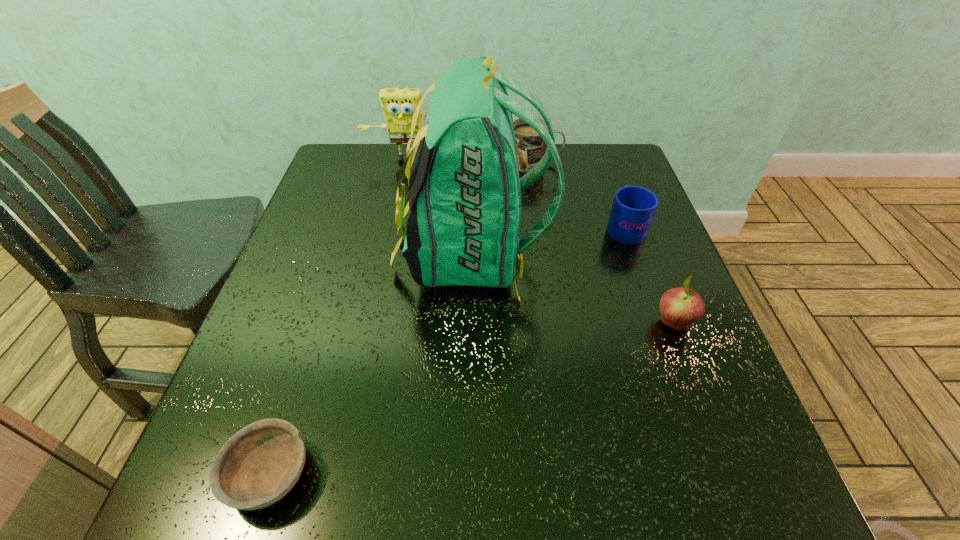
Find the location of `free space that satisfies the following two spatial constraints: 1. on the back of the apple; 2. on the left side of the tallest object`. free space that satisfies the following two spatial constraints: 1. on the back of the apple; 2. on the left side of the tallest object is located at coordinates (469, 323).

Where is `free space that satisfies the following two spatial constraints: 1. on the side with the handle of the nearer mug; 2. on the side of the farther mug with the handle`? free space that satisfies the following two spatial constraints: 1. on the side with the handle of the nearer mug; 2. on the side of the farther mug with the handle is located at coordinates (602, 164).

Where is `free space that satisfies the following two spatial constraints: 1. on the side of the left mug with the handle; 2. on the back side of the apple`? Image resolution: width=960 pixels, height=540 pixels. free space that satisfies the following two spatial constraints: 1. on the side of the left mug with the handle; 2. on the back side of the apple is located at coordinates (561, 323).

Locate an element on the screen. The height and width of the screenshot is (540, 960). vacant space that satisfies the following two spatial constraints: 1. on the back side of the apple; 2. on the side of the farther mug with the handle is located at coordinates (612, 164).

This screenshot has height=540, width=960. Find the location of `free region that satisfies the following two spatial constraints: 1. on the side of the apple with the handle; 2. on the right side of the left mug`. free region that satisfies the following two spatial constraints: 1. on the side of the apple with the handle; 2. on the right side of the left mug is located at coordinates (561, 323).

Identify the location of free location that satisfies the following two spatial constraints: 1. on the face of the fifth shortest object; 2. on the right side of the apple. The image size is (960, 540). click(x=373, y=323).